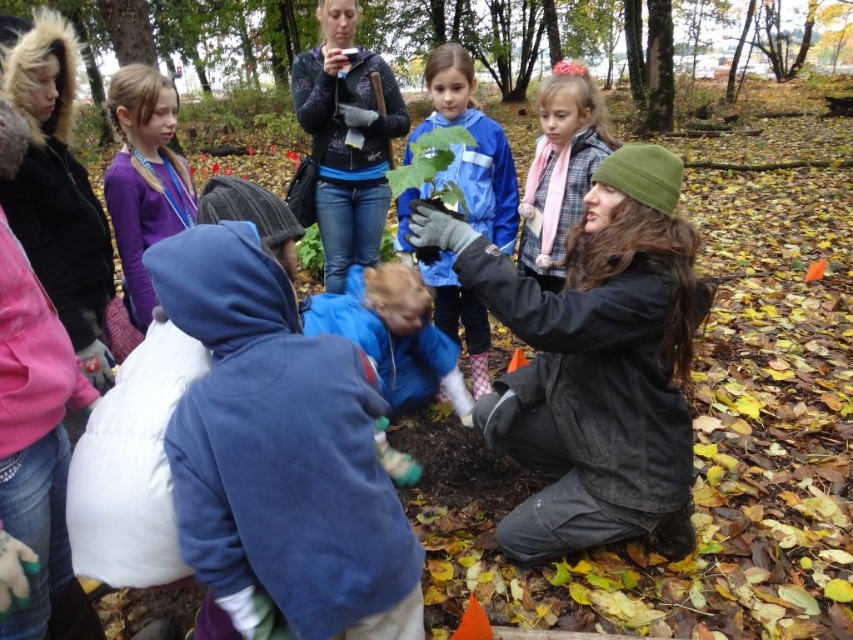
From the picture: Can you confirm if patterned fleece jacket at upper center is positioned above blue matte jacket at center?

Yes, patterned fleece jacket at upper center is above blue matte jacket at center.

Which of these two, patterned fleece jacket at upper center or blue matte jacket at center, stands shorter?

With less height is blue matte jacket at center.

Is point (379, 228) closer to viewer compared to point (463, 124)?

No, it is behind (463, 124).

Image resolution: width=853 pixels, height=640 pixels. I want to click on patterned fleece jacket at upper center, so click(x=347, y=138).

Between green leafy plant at upper center and purple fleece jacket at upper left, which one has less height?

With less height is purple fleece jacket at upper left.

Is green leafy plant at upper center further to camera compared to purple fleece jacket at upper left?

That is True.

This screenshot has width=853, height=640. Describe the element at coordinates (550, 36) in the screenshot. I see `green leafy plant at upper center` at that location.

This screenshot has width=853, height=640. In order to click on green leafy plant at upper center in this screenshot , I will do `click(550, 36)`.

Can you confirm if blue matte jacket at center is positioned below purple fleece jacket at upper left?

Correct, blue matte jacket at center is located below purple fleece jacket at upper left.

Image resolution: width=853 pixels, height=640 pixels. What are the coordinates of `blue matte jacket at center` in the screenshot? It's located at (469, 147).

Locate an element on the screen. blue matte jacket at center is located at coordinates (469, 147).